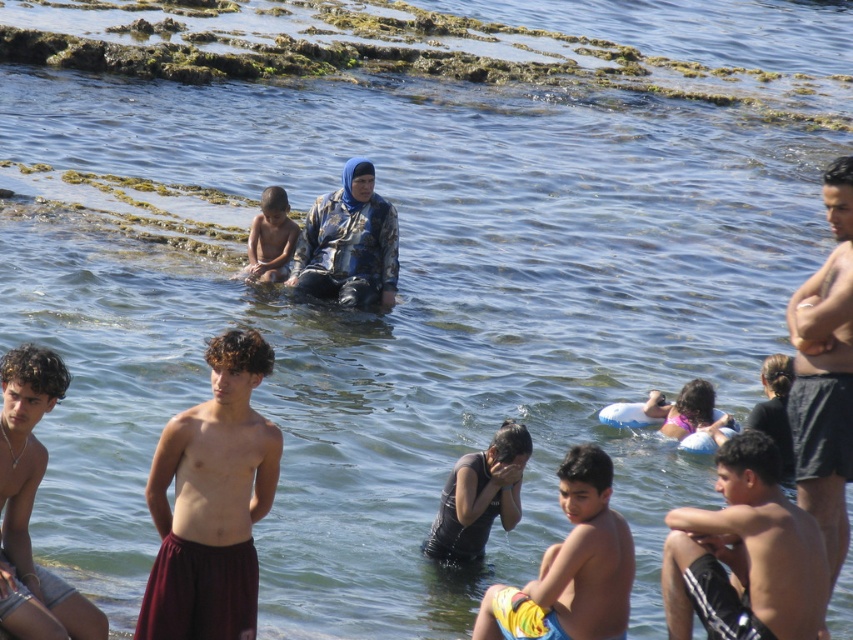
Can you confirm if dark blue shorts at right is smaller than light brown skin at center?

No, dark blue shorts at right is not smaller than light brown skin at center.

Does dark blue shorts at right appear over light brown skin at center?

Actually, dark blue shorts at right is below light brown skin at center.

Locate an element on the screen. dark blue shorts at right is located at coordinates (825, 374).

How distant is maroon fabric shorts at center from light brown skin at center?

The distance of maroon fabric shorts at center from light brown skin at center is 12.47 meters.

The height and width of the screenshot is (640, 853). Describe the element at coordinates (212, 500) in the screenshot. I see `maroon fabric shorts at center` at that location.

Where is `maroon fabric shorts at center`? This screenshot has width=853, height=640. maroon fabric shorts at center is located at coordinates (212, 500).

Which of these two, shiny silver necklace at lower left or camouflage fabric jacket at center, stands taller?

camouflage fabric jacket at center is taller.

Does shiny silver necklace at lower left have a greater height compared to camouflage fabric jacket at center?

No, shiny silver necklace at lower left is not taller than camouflage fabric jacket at center.

Locate an element on the screen. The width and height of the screenshot is (853, 640). shiny silver necklace at lower left is located at coordinates (32, 506).